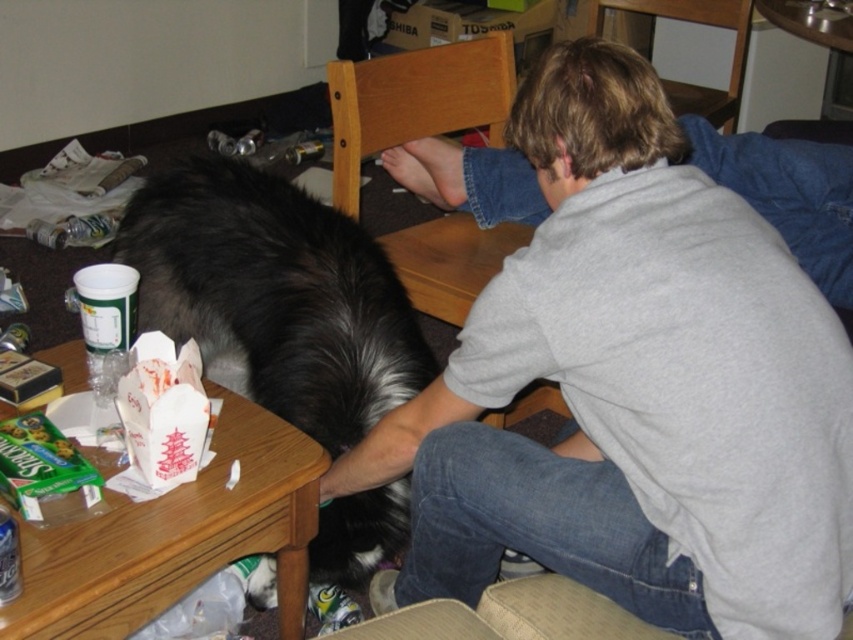
Based on the scene description, where is the black fur dog at center located in terms of coordinates?

The black fur dog at center is located at coordinates (274, 296).

You are a delivery robot entering the living room. You need to place a package on the wooden table at lower left. The black fur dog at center is in your way. Can you go around the dog to reach the table?

The black fur dog at center is further to the viewer than wooden table at lower left, meaning the dog is closer to you. Since the dog is closer, you can move around it to access the wooden table at lower left which is behind the dog.